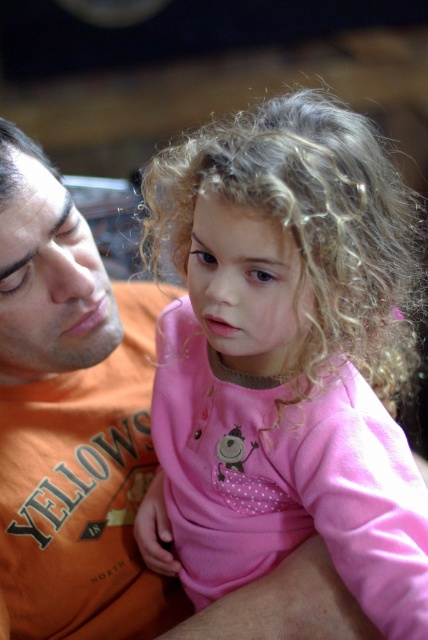
Question: Which of the following is the closest to the observer?

Choices:
 (A) orange cotton shirt at left
 (B) pink fabric at center

Answer: (B)

Question: Can you confirm if pink fabric at center is smaller than orange cotton shirt at left?

Choices:
 (A) yes
 (B) no

Answer: (B)

Question: Does pink fabric at center come in front of orange cotton shirt at left?

Choices:
 (A) no
 (B) yes

Answer: (B)

Question: Is pink fabric at center to the right of orange cotton shirt at left from the viewer's perspective?

Choices:
 (A) no
 (B) yes

Answer: (B)